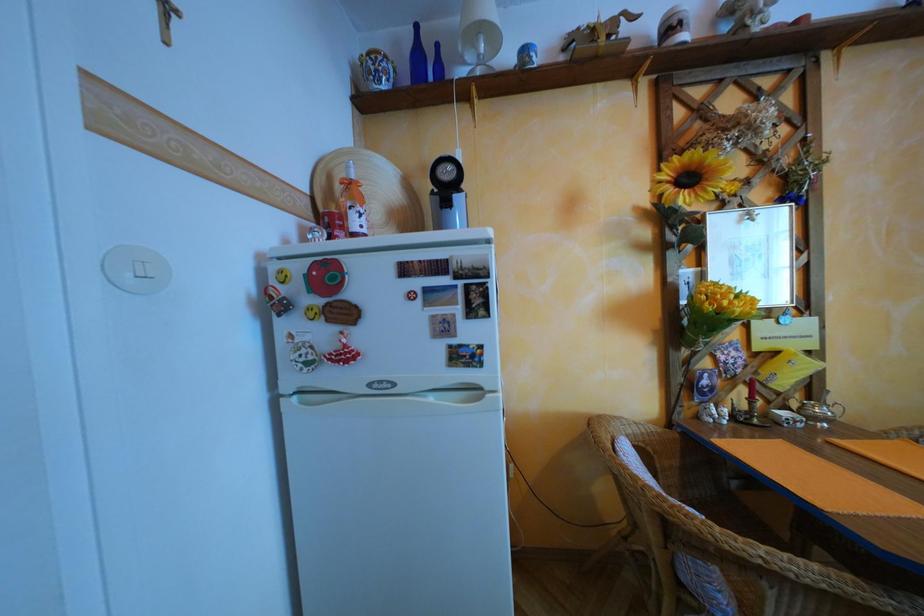
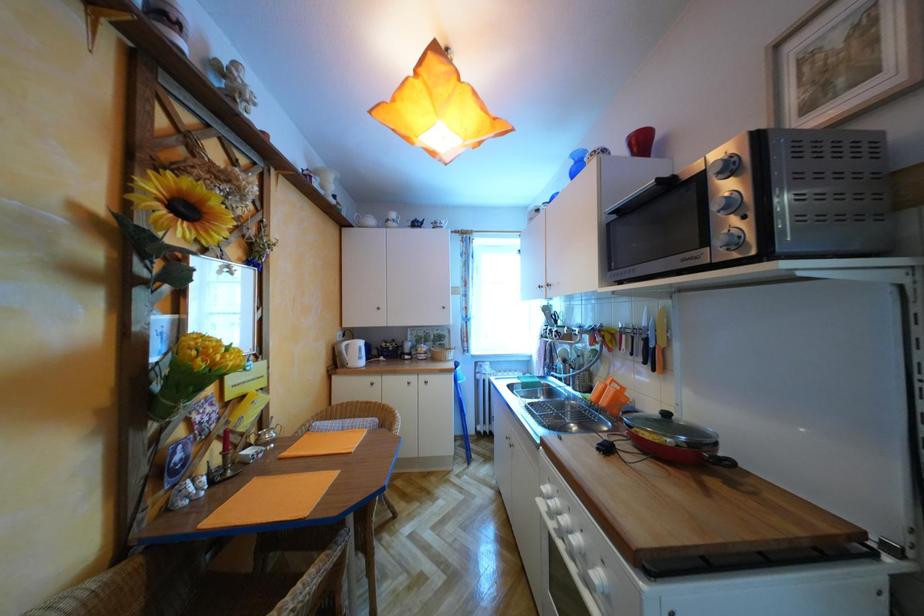
Question: The images are taken continuously from a first-person perspective. In which direction is your viewpoint rotating?

Choices:
 (A) Left
 (B) Right
 (C) Up
 (D) Down

Answer: (B)